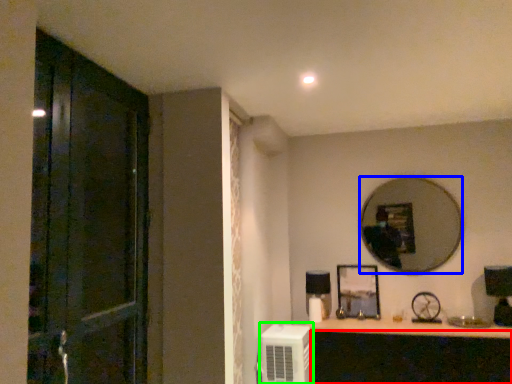
Question: Estimate the real-world distances between objects in this image. Which object is farther from cabinetry (highlighted by a red box), mirror (highlighted by a blue box) or air conditioner (highlighted by a green box)?

Choices:
 (A) mirror
 (B) air conditioner

Answer: (A)